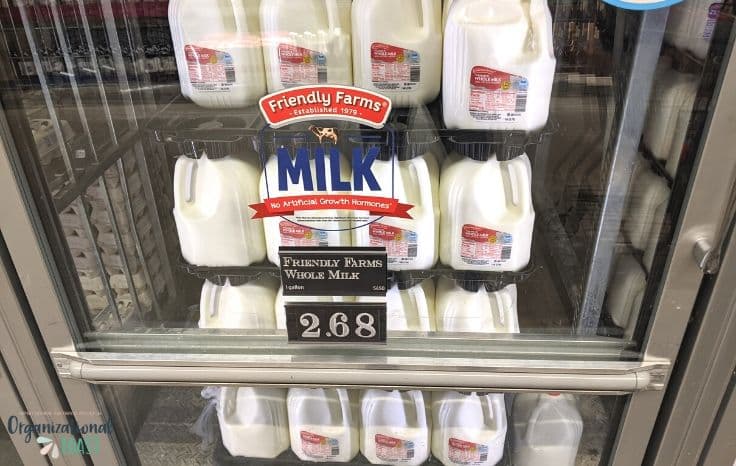
The image size is (736, 466). In order to click on milk on the second from the top shelf in this screenshot , I will do `click(221, 198)`, `click(268, 185)`, `click(402, 191)`, `click(470, 191)`.